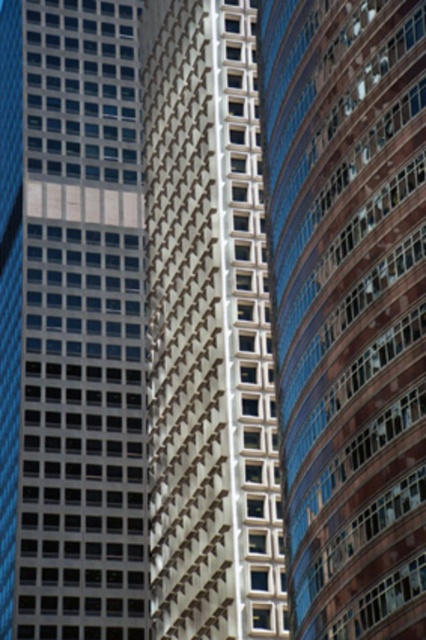
You are standing at the base of the white textured building at center and want to walk to the smooth glass skyscraper at center. Which direction should you face to head towards it?

You should face to the right to head towards the smooth glass skyscraper at center since it is located to the right of the white textured building at center.

You are standing at the origin point in the image and want to move towards the matte glass skyscraper at center. What are the coordinates you should head towards?

The coordinates you should head towards are [71,323].